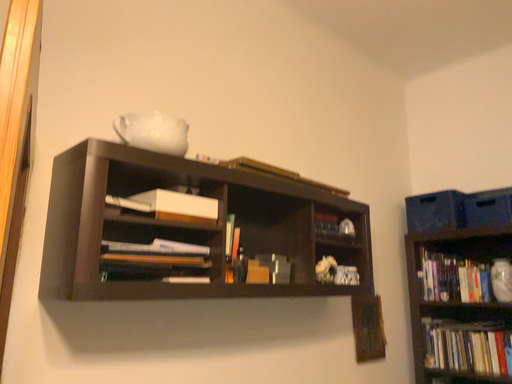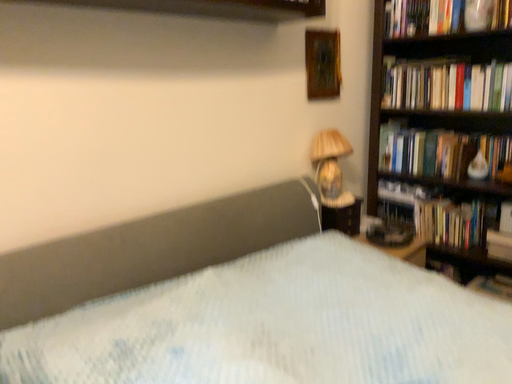
Question: How did the camera likely rotate when shooting the video?

Choices:
 (A) rotated upward
 (B) rotated downward

Answer: (B)